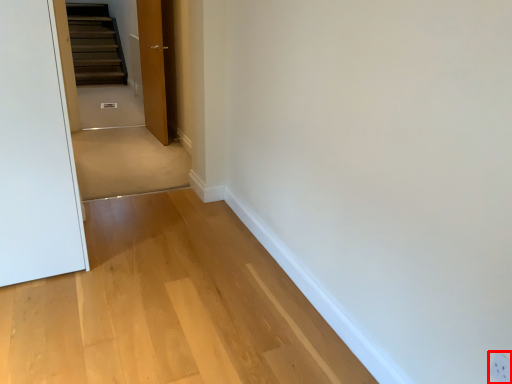
Question: From the image's perspective, where is electric outlet (annotated by the red box) located relative to door?

Choices:
 (A) above
 (B) below

Answer: (B)